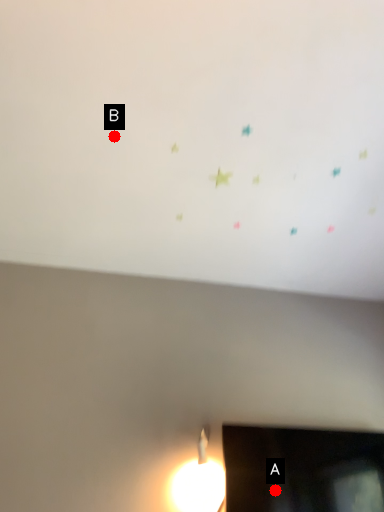
Question: Two points are circled on the image, labeled by A and B beside each circle. Which point is closer to the camera?

Choices:
 (A) A is closer
 (B) B is closer

Answer: (B)